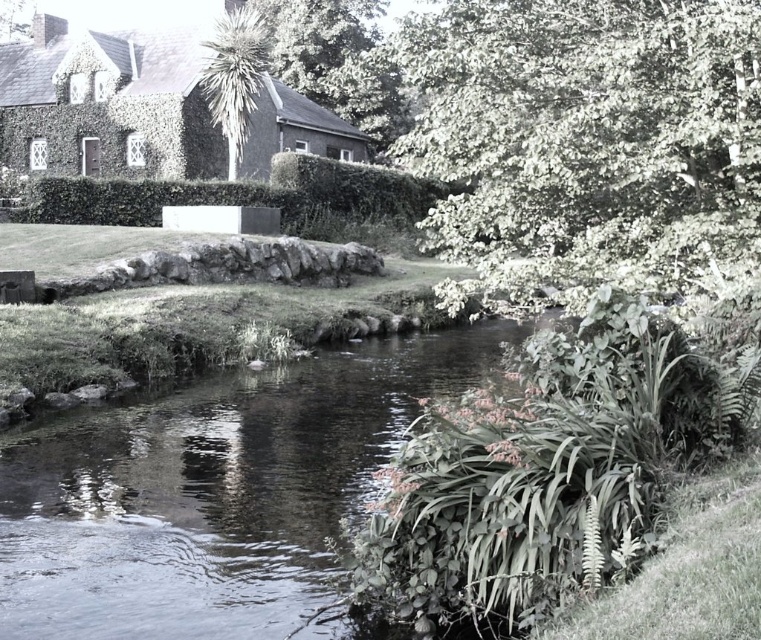
Who is shorter, green leafy tree at upper right or green leafy tree at upper center?

A: green leafy tree at upper center

Who is positioned more to the right, green leafy tree at upper right or green leafy tree at upper center?

From the viewer's perspective, green leafy tree at upper right appears more on the right side.

Is point (709, 113) closer to viewer compared to point (240, 138)?

Yes, it is in front of point (240, 138).

The image size is (761, 640). Find the location of `green leafy tree at upper right`. green leafy tree at upper right is located at coordinates (588, 132).

Is clear water at center smaller than green leafy tree at upper center?

Yes, clear water at center is smaller than green leafy tree at upper center.

Identify the location of clear water at center. The width and height of the screenshot is (761, 640). (212, 492).

Who is shorter, clear water at center or green leafy tree at upper right?

Standing shorter between the two is clear water at center.

Between point (196, 627) and point (581, 104), which one is positioned behind?

The point (581, 104) is more distant.

This screenshot has height=640, width=761. I want to click on clear water at center, so click(212, 492).